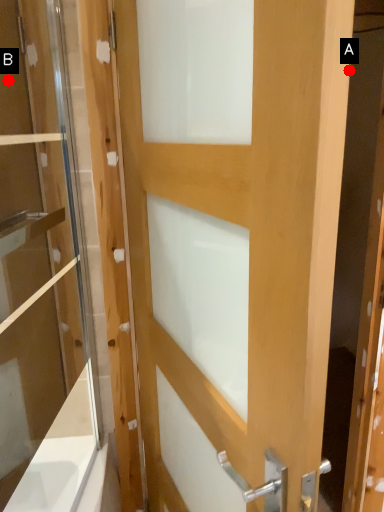
Question: Two points are circled on the image, labeled by A and B beside each circle. Which point is closer to the camera?

Choices:
 (A) A is closer
 (B) B is closer

Answer: (B)